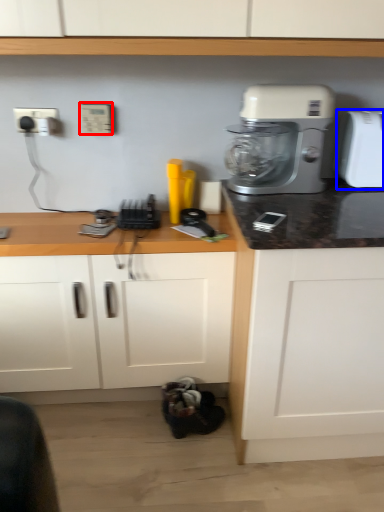
Question: Among these objects, which one is nearest to the camera, electric outlet (highlighted by a red box) or toaster (highlighted by a blue box)?

Choices:
 (A) electric outlet
 (B) toaster

Answer: (B)